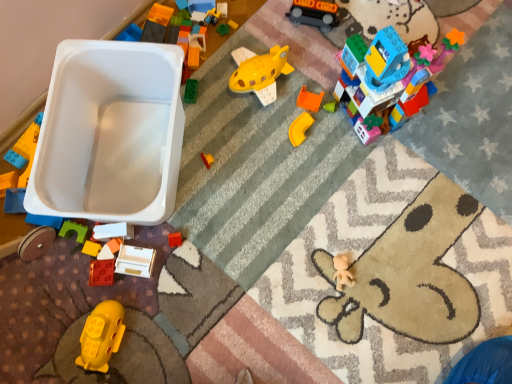
Identify the location of free space between yellow matte plastic corner piece at center-right, acting as the third toy starting from the right, and matte white drawer at lower center, which is counted as the 5th toy, starting from the left. (223, 193).